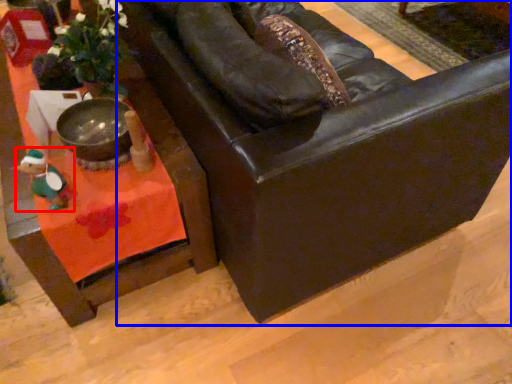
Question: Which object appears closest to the camera in this image, toy (highlighted by a red box) or chair (highlighted by a blue box)?

Choices:
 (A) toy
 (B) chair

Answer: (B)